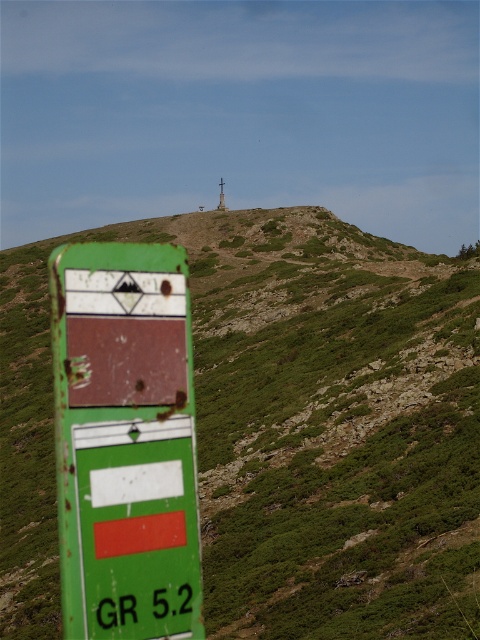
You are a hiker trying to navigate through the GR 5.2 trail. You see the green grassy hillside at upper center and the rusty green sign at left. Which object would block your view more if you were standing at the base of the hill?

The green grassy hillside at upper center would block your view more because it is larger in size compared to the rusty green sign at left.

You are a hiker trying to determine the elevation difference between the green grassy hillside at upper center and the rusty green sign at left. Which one is higher in elevation?

The green grassy hillside at upper center is taller than the rusty green sign at left, so it has a higher elevation.